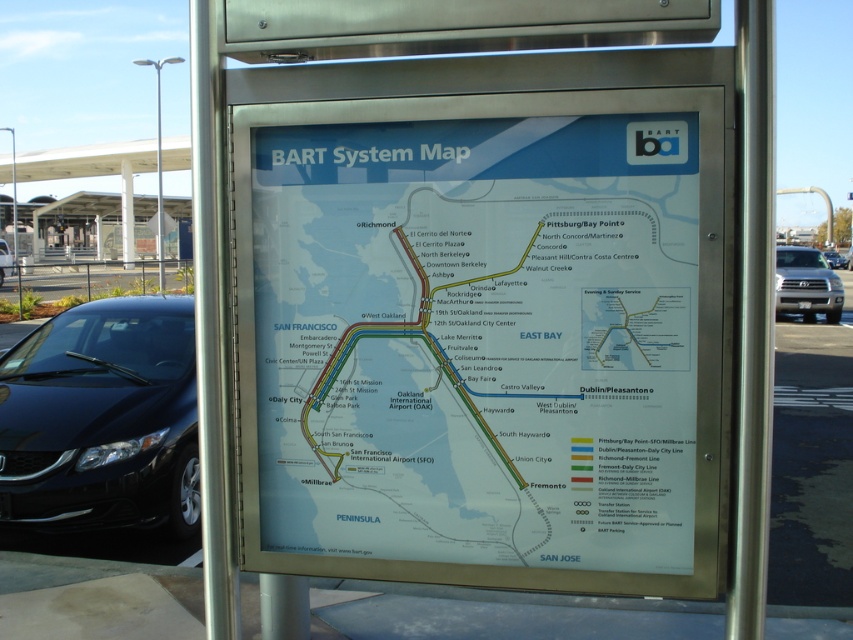
Question: Does shiny black sedan at left lie in front of silver metallic suv at right?

Choices:
 (A) yes
 (B) no

Answer: (A)

Question: Does black glossy sedan at lower left have a greater width compared to silver metallic truck at right?

Choices:
 (A) no
 (B) yes

Answer: (A)

Question: Estimate the real-world distances between objects in this image. Which object is farther from the shiny black sedan at left?

Choices:
 (A) silver metallic suv at right
 (B) silver metallic truck at right
 (C) black glossy sedan at lower left

Answer: (A)

Question: Is silver metallic truck at right to the left of silver metallic suv at right from the viewer's perspective?

Choices:
 (A) yes
 (B) no

Answer: (A)

Question: Which point is closer to the camera?

Choices:
 (A) silver metallic suv at right
 (B) white paper map at center
 (C) black glossy sedan at lower left

Answer: (B)

Question: Which object is farther from the camera taking this photo?

Choices:
 (A) silver metallic truck at right
 (B) black glossy sedan at lower left
 (C) white paper map at center

Answer: (A)